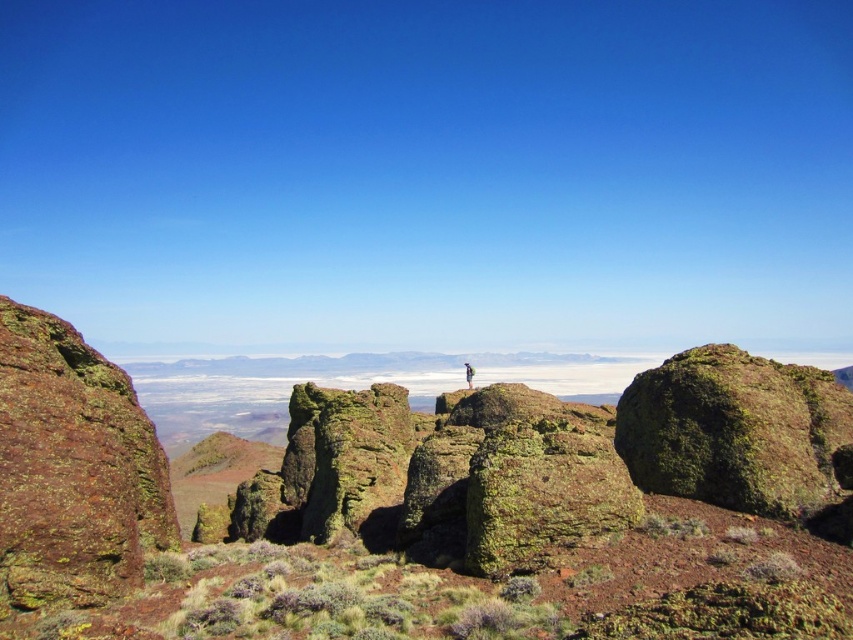
Question: In this image, where is green mossy rock at center-right located relative to green textured jacket at center?

Choices:
 (A) left
 (B) right

Answer: (B)

Question: Is green mossy rock at center-right wider than green textured jacket at center?

Choices:
 (A) no
 (B) yes

Answer: (B)

Question: Which object is closer to the camera taking this photo?

Choices:
 (A) green mossy rock at center
 (B) green mossy rock at center-right
 (C) green textured jacket at center

Answer: (A)

Question: Which object is the farthest from the green mossy rock at center-right?

Choices:
 (A) green mossy rock at center
 (B) green textured jacket at center

Answer: (B)

Question: Considering the real-world distances, which object is farthest from the green textured jacket at center?

Choices:
 (A) green mossy rock at center-right
 (B) green mossy rock at center

Answer: (A)

Question: Is green mossy rock at center-right to the right of green textured jacket at center from the viewer's perspective?

Choices:
 (A) yes
 (B) no

Answer: (A)